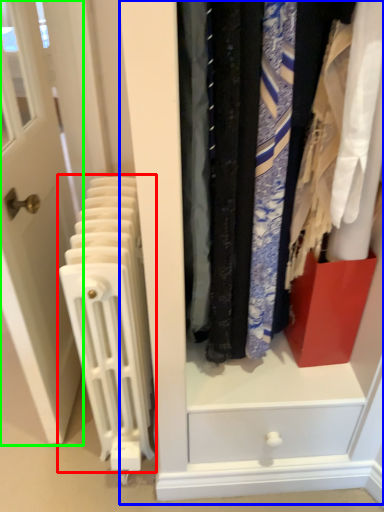
Question: Based on their relative distances, which object is nearer to radiator (highlighted by a red box)? Choose from dresser (highlighted by a blue box) and door (highlighted by a green box).

Choices:
 (A) dresser
 (B) door

Answer: (B)